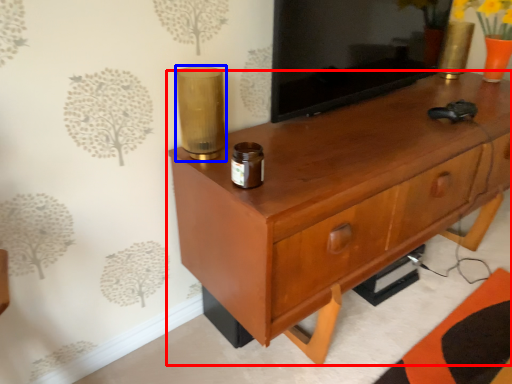
Question: Which object appears closest to the camera in this image, chest of drawers (highlighted by a red box) or candle holder (highlighted by a blue box)?

Choices:
 (A) chest of drawers
 (B) candle holder

Answer: (A)